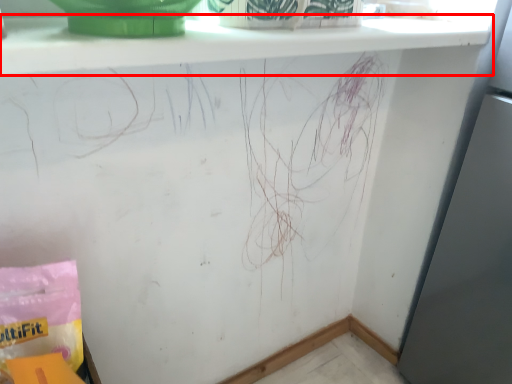
Question: In this image, where is window sill (annotated by the red box) located relative to material?

Choices:
 (A) left
 (B) right

Answer: (B)